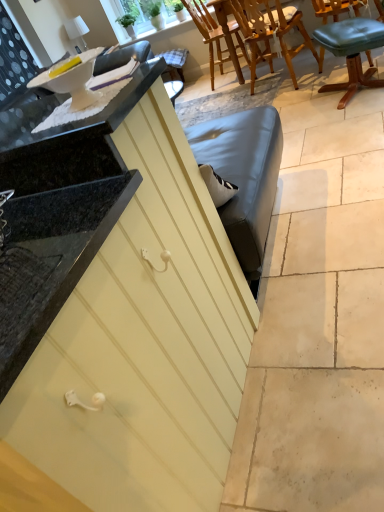
Question: Does point (379, 28) appear closer or farther from the camera than point (162, 204)?

Choices:
 (A) closer
 (B) farther

Answer: (B)

Question: From a real-world perspective, is green leather stool at upper right, the third chair from the back, physically located above or below matte yellow cabinet at center?

Choices:
 (A) below
 (B) above

Answer: (A)

Question: Which of these objects is positioned closest to the wooden chair at upper center, which is the third chair in front-to-back order?

Choices:
 (A) matte yellow cabinet at center
 (B) wooden chair at upper center, which appears as the second chair when viewed from the front
 (C) green leather stool at upper right, which is counted as the first chair, starting from the front
 (D) white glossy countertop at upper left

Answer: (B)

Question: Estimate the real-world distances between objects in this image. Which object is farther from the wooden chair at upper center, arranged as the first chair when viewed from the back?

Choices:
 (A) matte yellow cabinet at center
 (B) green leather stool at upper right, the third chair from the back
 (C) wooden chair at upper center, marked as the second chair in a back-to-front arrangement
 (D) white glossy countertop at upper left

Answer: (A)